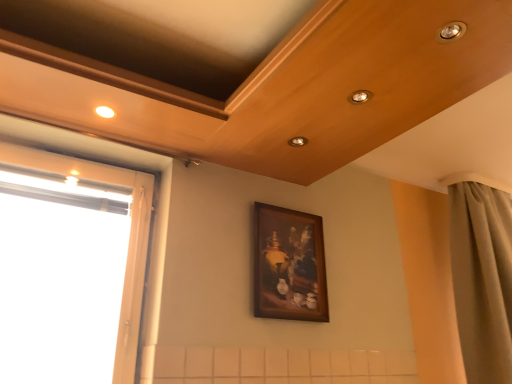
Question: Considering the positions of matte beige curtain at right and wooden framed painting at center in the image, is matte beige curtain at right wider or thinner than wooden framed painting at center?

Choices:
 (A) thin
 (B) wide

Answer: (B)

Question: Relative to wooden framed painting at center, is matte beige curtain at right in front or behind?

Choices:
 (A) front
 (B) behind

Answer: (B)

Question: Which of these objects is positioned farthest from the wooden framed painting at center?

Choices:
 (A) transparent glass window at left
 (B) matte beige curtain at right

Answer: (B)

Question: Based on their relative distances, which object is nearer to the transparent glass window at left?

Choices:
 (A) matte beige curtain at right
 (B) wooden framed painting at center

Answer: (B)